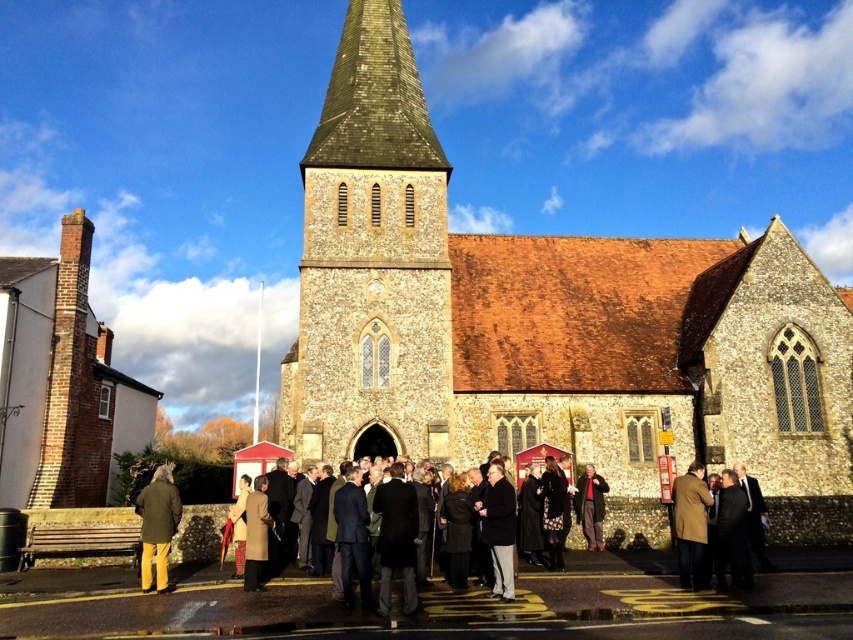
Between dark brown leather jackets at center and dark gray suit at center, which one appears on the left side from the viewer's perspective?

dark brown leather jackets at center is more to the left.

Which of these two, dark brown leather jackets at center or dark gray suit at center, stands shorter?

With less height is dark gray suit at center.

Looking at this image, who is more forward, (393, 600) or (506, 540)?

Point (393, 600)

Where is `dark brown leather jackets at center`? This screenshot has width=853, height=640. dark brown leather jackets at center is located at coordinates pyautogui.click(x=482, y=605).

Is stone church at center positioned in front of brown stone tower at center?

Yes, stone church at center is in front of brown stone tower at center.

Does point (779, 460) come behind point (444, 380)?

Yes, point (779, 460) is behind point (444, 380).

You are a GUI agent. You are given a task and a screenshot of the screen. Output one action in this format:
    pyautogui.click(x=<x>, y=<y>)
    Task: Click on the stone church at center
    This screenshot has width=853, height=640.
    Given the screenshot: What is the action you would take?
    pyautogui.click(x=550, y=324)

Can you confirm if dark brown leather jackets at center is positioned above brown wool coat at center?

No, dark brown leather jackets at center is not above brown wool coat at center.

Who is positioned more to the right, dark brown leather jackets at center or brown wool coat at center?

Positioned to the right is brown wool coat at center.

Locate an element on the screen. This screenshot has height=640, width=853. dark brown leather jackets at center is located at coordinates (482, 605).